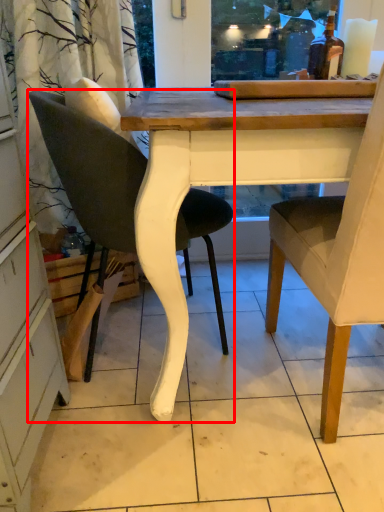
Question: Observing the image, what is the correct spatial positioning of chair (annotated by the red box) in reference to chair?

Choices:
 (A) left
 (B) right

Answer: (A)